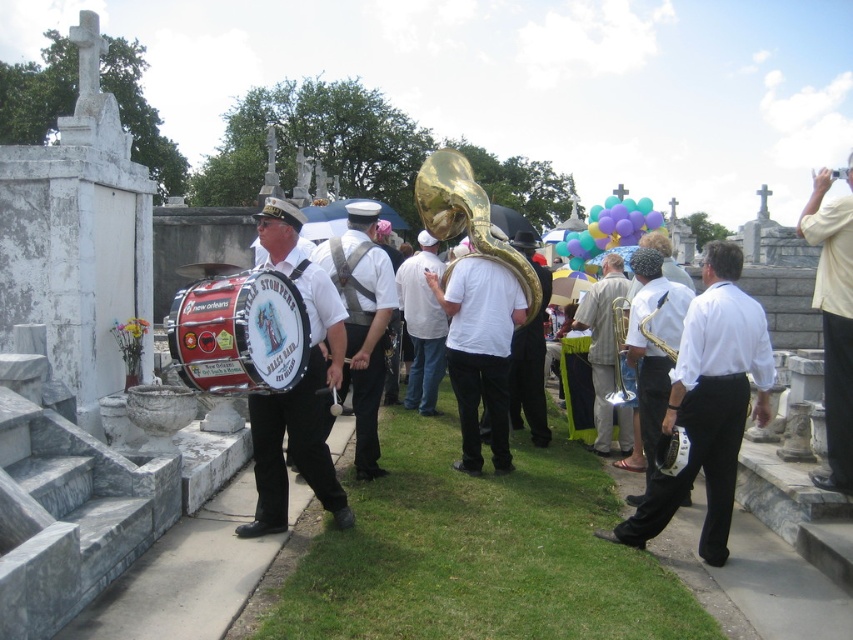
You are a photographer standing at the edge of the cemetery path. You want to capture a photo that includes both the yellow shirt at upper right and the gold brass trombone at center. The camera you are using has a maximum focus range of 2 meters. Will both subjects be in focus if you focus on the closer one?

The distance between the yellow shirt at upper right and the gold brass trombone at center is 1.94 meters. Since the maximum focus range is 2 meters, focusing on the closer subject will keep both within the focus range, so yes, both will be in focus.

You are a photographer standing at the back of the group. You want to take a photo that includes both the yellow shirt at upper right and the gold brass trombone at center. Which object should you focus on first to ensure both are in clear view?

You should focus on the yellow shirt at upper right first because it is closer to the viewer than the gold brass trombone at center, ensuring both are in focus when adjusting the camera settings.

You are a photographer trying to capture the gold brass trumpet at center and the gold metallic tuba at center in a single shot. Based on their positions, which instrument should you focus on first to ensure both are in frame?

The gold brass trumpet at center is located above the gold metallic tuba at center, so you should focus on the gold metallic tuba at center first to ensure both are in frame.